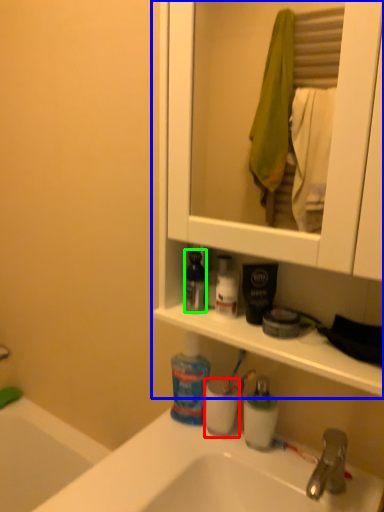
Question: Considering the real-world distances, which object is closest to mouthwash (highlighted by a red box)? cabinetry (highlighted by a blue box) or mouthwash (highlighted by a green box).

Choices:
 (A) cabinetry
 (B) mouthwash

Answer: (B)